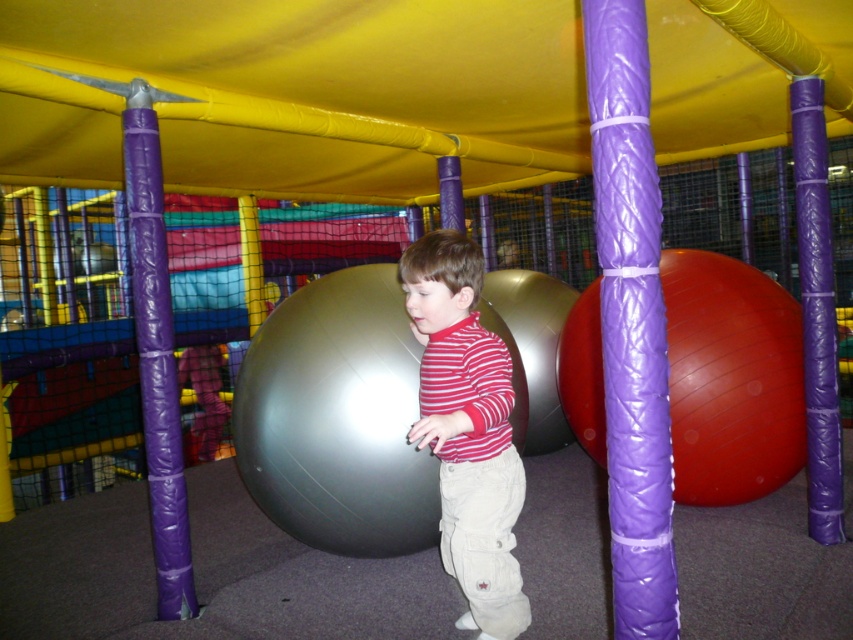
Can you confirm if striped cotton shirt at center is positioned to the left of purple rubber pole at left?

Incorrect, striped cotton shirt at center is not on the left side of purple rubber pole at left.

Can you confirm if striped cotton shirt at center is positioned to the right of purple rubber pole at left?

Indeed, striped cotton shirt at center is positioned on the right side of purple rubber pole at left.

Who is more distant from viewer, (502,461) or (146,209)?

The point (146,209) is behind.

You are a GUI agent. You are given a task and a screenshot of the screen. Output one action in this format:
    pyautogui.click(x=<x>, y=<y>)
    Task: Click on the striped cotton shirt at center
    Image resolution: width=853 pixels, height=640 pixels.
    Given the screenshot: What is the action you would take?
    pyautogui.click(x=467, y=429)

Can you confirm if metallic gray ball at center is smaller than purple rubber pole at left?

Incorrect, metallic gray ball at center is not smaller in size than purple rubber pole at left.

Is metallic gray ball at center in front of purple rubber pole at left?

Yes.

The image size is (853, 640). In order to click on metallic gray ball at center in this screenshot , I will do `click(337, 419)`.

I want to click on metallic gray ball at center, so click(x=337, y=419).

Is metallic gray ball at center shorter than striped cotton shirt at center?

Indeed, metallic gray ball at center has a lesser height compared to striped cotton shirt at center.

Can you confirm if metallic gray ball at center is positioned to the right of striped cotton shirt at center?

No, metallic gray ball at center is not to the right of striped cotton shirt at center.

Describe the element at coordinates (337, 419) in the screenshot. I see `metallic gray ball at center` at that location.

You are a GUI agent. You are given a task and a screenshot of the screen. Output one action in this format:
    pyautogui.click(x=<x>, y=<y>)
    Task: Click on the metallic gray ball at center
    This screenshot has width=853, height=640.
    Given the screenshot: What is the action you would take?
    pyautogui.click(x=337, y=419)